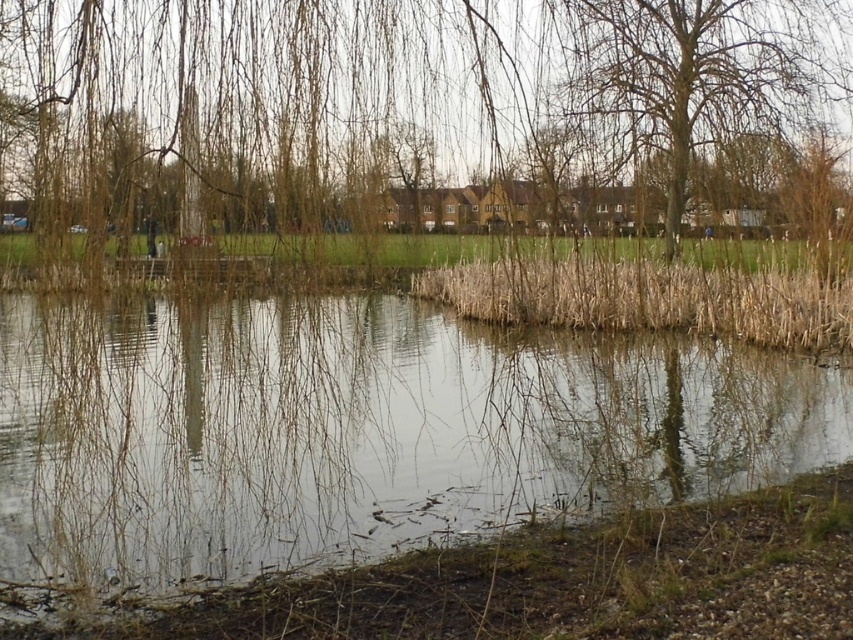
You are standing on the edge of the pond and want to place a 2 meter long wooden board between the clear water at center and the bare branches at upper center. Will the board fit without bending or breaking?

The distance between the clear water at center and the bare branches at upper center is 2.14 meters, so a 2 meter long wooden board will fit without bending or breaking since it is shorter than the distance.

You are standing at the edge of the pond and want to take a photo of the clear water at center and the bare branches at upper center. Which object will appear closer to the camera in the photo?

The clear water at center will appear closer to the camera in the photo because it is positioned in front of the bare branches at upper center.

You are standing at the edge of the pond and want to place a small floating decoration. The decoration requires being placed on the surface closest to you. Which object should you choose between the clear water at center and the dry grass at center?

The clear water at center is closer to the viewer than the dry grass at center, so you should place the decoration on the clear water at center.